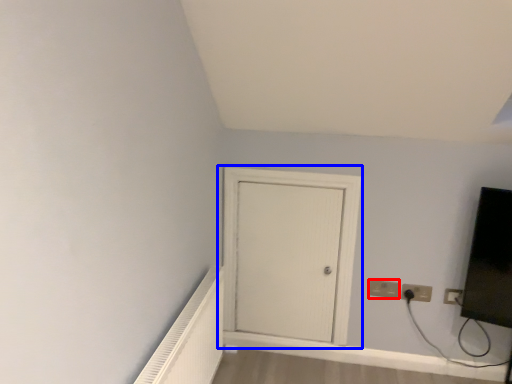
Question: Which object appears closest to the camera in this image, electric outlet (highlighted by a red box) or door (highlighted by a blue box)?

Choices:
 (A) electric outlet
 (B) door

Answer: (B)